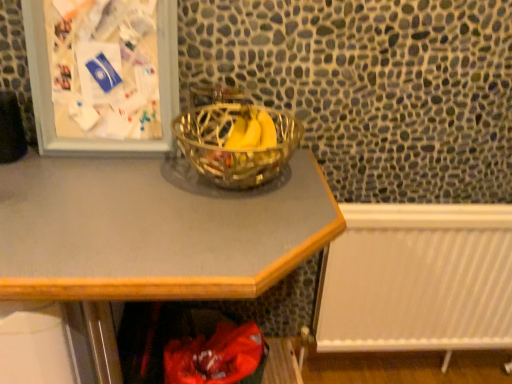
Question: Is metallic gray desk at center aimed at metallic silver picture frame at upper left?

Choices:
 (A) yes
 (B) no

Answer: (B)

Question: Is metallic gray desk at center oriented away from metallic silver picture frame at upper left?

Choices:
 (A) yes
 (B) no

Answer: (B)

Question: Can you confirm if metallic gray desk at center is smaller than metallic silver picture frame at upper left?

Choices:
 (A) no
 (B) yes

Answer: (A)

Question: Considering the relative positions of metallic gray desk at center and metallic silver picture frame at upper left in the image provided, is metallic gray desk at center to the right of metallic silver picture frame at upper left from the viewer's perspective?

Choices:
 (A) no
 (B) yes

Answer: (B)

Question: Is metallic gray desk at center surrounding metallic silver picture frame at upper left?

Choices:
 (A) yes
 (B) no

Answer: (B)

Question: Looking at their shapes, would you say clear glass bowl at center is wider or thinner than metallic gray desk at center?

Choices:
 (A) wide
 (B) thin

Answer: (B)

Question: In the image, is clear glass bowl at center on the left side or the right side of metallic gray desk at center?

Choices:
 (A) left
 (B) right

Answer: (B)

Question: Do you think clear glass bowl at center is within metallic gray desk at center, or outside of it?

Choices:
 (A) outside
 (B) inside

Answer: (A)

Question: Is clear glass bowl at center bigger or smaller than metallic gray desk at center?

Choices:
 (A) big
 (B) small

Answer: (B)

Question: Relative to clear glass bowl at center, is metallic gray desk at center in front or behind?

Choices:
 (A) behind
 (B) front

Answer: (B)

Question: From a real-world perspective, is metallic gray desk at center positioned above or below clear glass bowl at center?

Choices:
 (A) below
 (B) above

Answer: (A)

Question: Is metallic gray desk at center wider or thinner than clear glass bowl at center?

Choices:
 (A) thin
 (B) wide

Answer: (B)

Question: Is metallic gray desk at center inside or outside of clear glass bowl at center?

Choices:
 (A) inside
 (B) outside

Answer: (B)

Question: Visually, is white plastic radiator at lower right positioned to the left or to the right of metallic gray desk at center?

Choices:
 (A) right
 (B) left

Answer: (A)

Question: Looking at their shapes, would you say white plastic radiator at lower right is wider or thinner than metallic gray desk at center?

Choices:
 (A) thin
 (B) wide

Answer: (A)